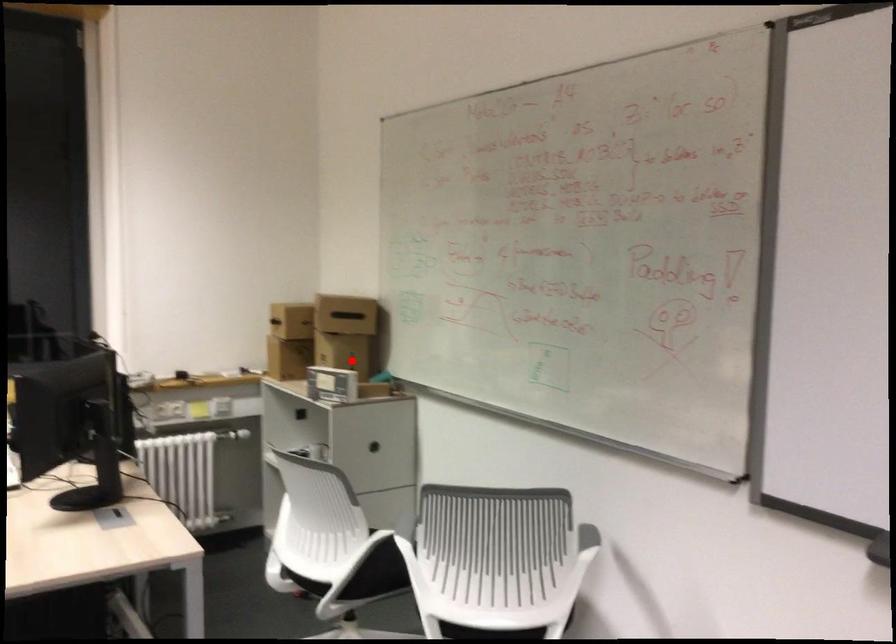
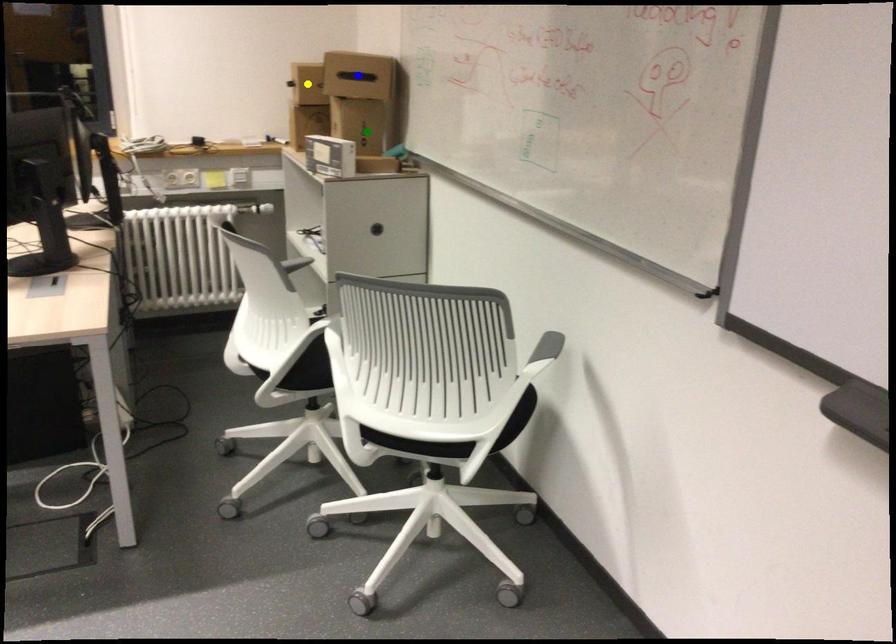
Question: I am providing you with two images of the same scene from different viewpoints. A red point is marked on the first image. You are given multiple points on the second image. Can you choose the point in image 2 that corresponds to the point in image 1?

Choices:
 (A) yellow point
 (B) green point
 (C) blue point

Answer: (B)